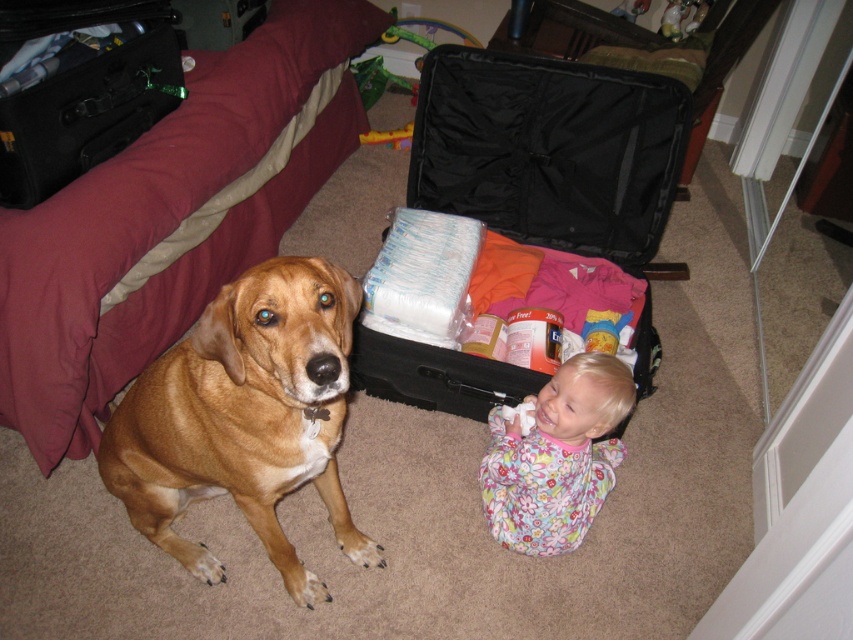
Question: Is black fabric suitcase at center wider than brown furry dog at left?

Choices:
 (A) no
 (B) yes

Answer: (B)

Question: Is the position of black fabric suitcase at center less distant than that of brown furry dog at left?

Choices:
 (A) yes
 (B) no

Answer: (B)

Question: Estimate the real-world distances between objects in this image. Which object is closer to the black fabric suitcase at center?

Choices:
 (A) floral fabric baby at center
 (B) brown furry dog at left

Answer: (A)

Question: Is black fabric suitcase at center wider than brown furry dog at left?

Choices:
 (A) yes
 (B) no

Answer: (A)

Question: Based on their relative distances, which object is farther from the black fabric suitcase at center?

Choices:
 (A) brown furry dog at left
 (B) floral fabric baby at center

Answer: (A)

Question: Which object is the farthest from the brown furry dog at left?

Choices:
 (A) floral fabric baby at center
 (B) black fabric suitcase at center

Answer: (B)